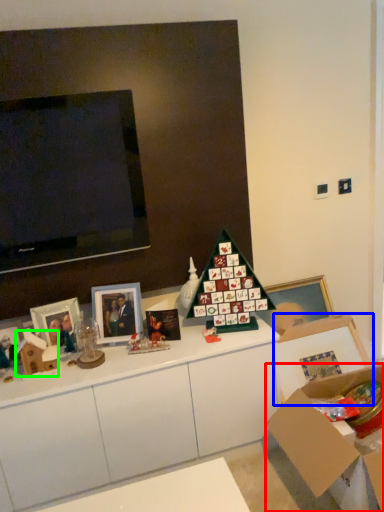
Question: Which object is the closest to the cardboard box (highlighted by a red box)? Choose among these: picture frame (highlighted by a blue box) or box (highlighted by a green box).

Choices:
 (A) picture frame
 (B) box

Answer: (A)